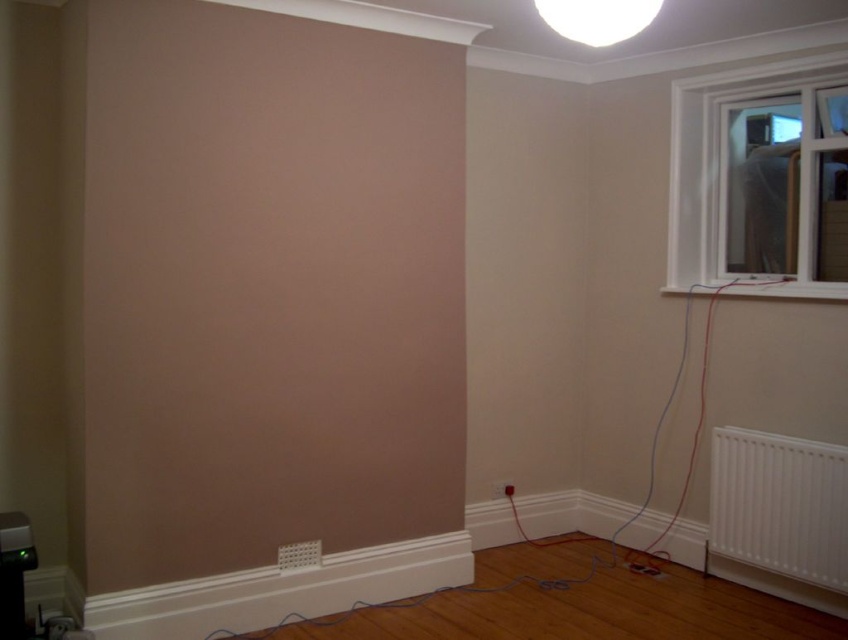
Question: Observing the image, what is the correct spatial positioning of white plastic radiator at lower right in reference to white plastic window at upper right?

Choices:
 (A) right
 (B) left

Answer: (A)

Question: Can you confirm if white plastic radiator at lower right is positioned above white glossy ceiling light at upper center?

Choices:
 (A) yes
 (B) no

Answer: (B)

Question: Which object appears closest to the camera in this image?

Choices:
 (A) white plastic window at upper right
 (B) white glossy ceiling light at upper center

Answer: (B)

Question: Based on their relative distances, which object is farther from the white plastic window at upper right?

Choices:
 (A) white glossy ceiling light at upper center
 (B) white plastic radiator at lower right

Answer: (A)

Question: Is white plastic radiator at lower right smaller than white plastic window at upper right?

Choices:
 (A) yes
 (B) no

Answer: (A)

Question: Among these objects, which one is nearest to the camera?

Choices:
 (A) white plastic window at upper right
 (B) white plastic radiator at lower right

Answer: (B)